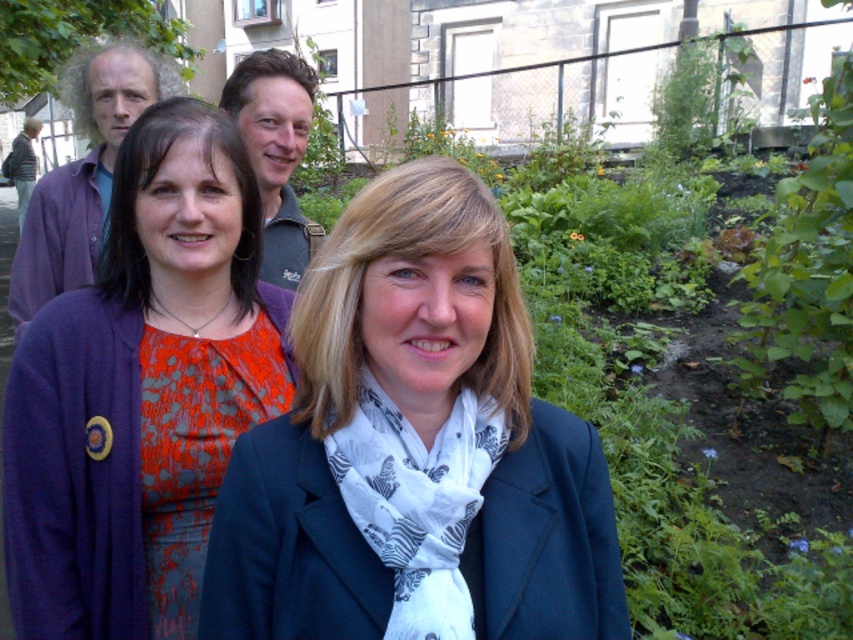
Which of these two, matte black blazer at center or green textured shirt at center, stands taller?

green textured shirt at center is taller.

Is point (311, 602) behind point (283, 74)?

No, (311, 602) is in front of (283, 74).

Where is `matte black blazer at center`? The image size is (853, 640). matte black blazer at center is located at coordinates (413, 438).

Does point (488, 624) come behind point (21, 552)?

No, it is in front of (21, 552).

Which is in front, point (495, 376) or point (186, 576)?

Point (495, 376) is more forward.

Where is `matte black blazer at center`? This screenshot has width=853, height=640. matte black blazer at center is located at coordinates (413, 438).

Can you confirm if matte purple cardigan at center is bigger than green textured shirt at center?

No, matte purple cardigan at center is not bigger than green textured shirt at center.

How far apart are matte purple cardigan at center and green textured shirt at center?

matte purple cardigan at center is 16.60 inches away from green textured shirt at center.

Between point (30, 381) and point (288, 131), which one is positioned in front?

Point (30, 381) is more forward.

This screenshot has width=853, height=640. In order to click on matte purple cardigan at center in this screenshot , I will do `click(125, 387)`.